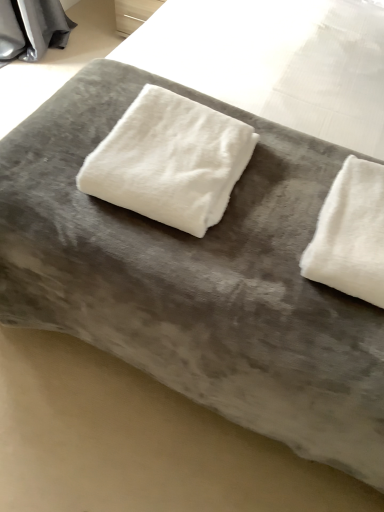
You are a GUI agent. You are given a task and a screenshot of the screen. Output one action in this format:
    pyautogui.click(x=<x>, y=<y>)
    Task: Click on the free space to the left of white fluffy towel at right, the first towel viewed from the right
    This screenshot has height=512, width=384.
    Given the screenshot: What is the action you would take?
    pos(263,236)